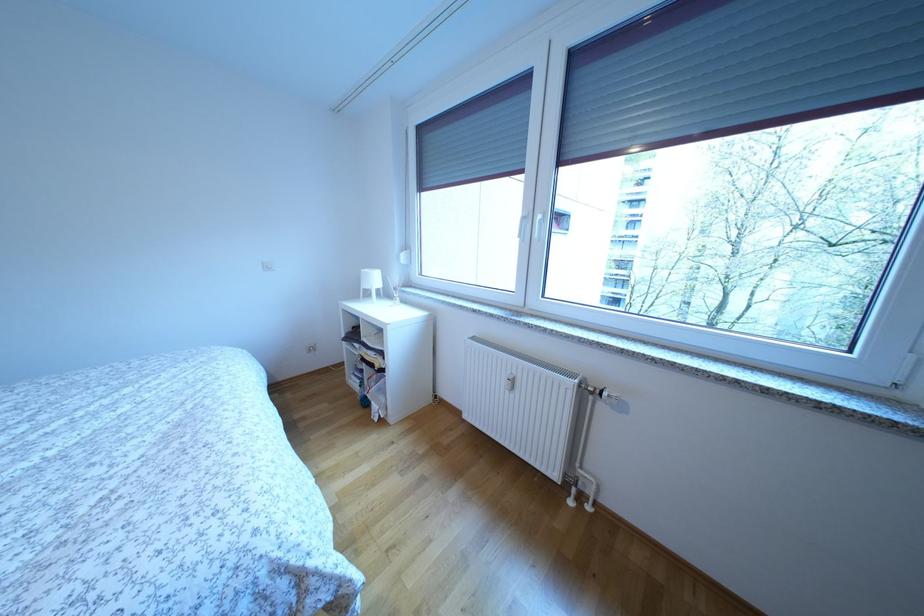
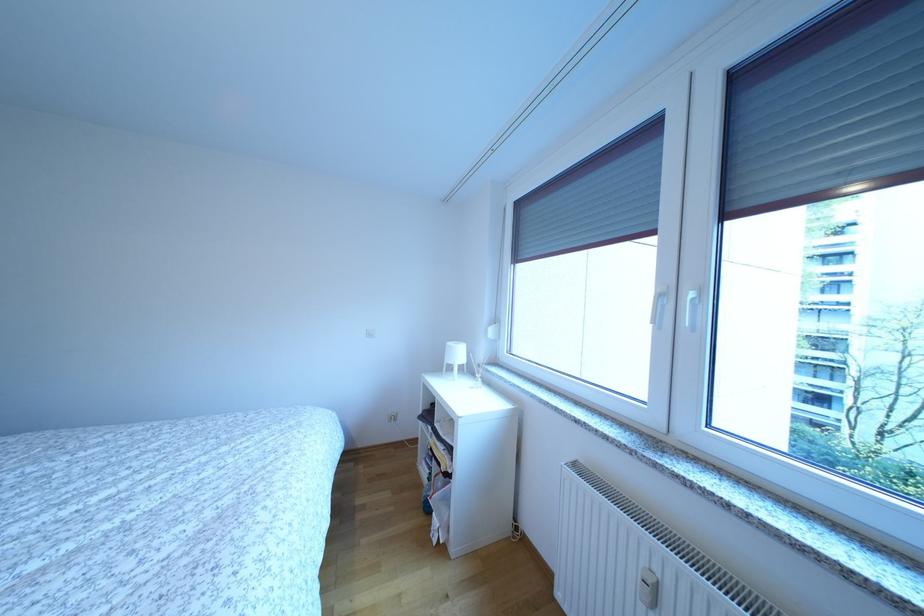
Question: The first image is from the beginning of the video and the second image is from the end. How did the camera likely rotate when shooting the video?

Choices:
 (A) Left
 (B) Right
 (C) Up
 (D) Down

Answer: (A)